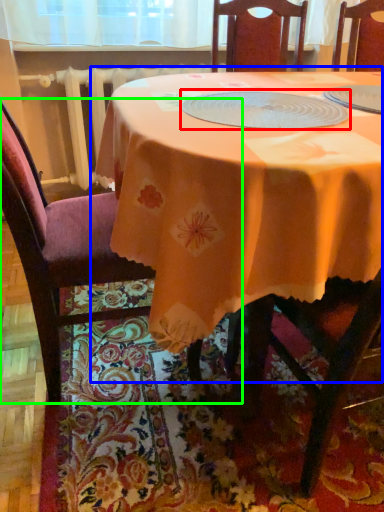
Question: Which object is positioned farthest from tableware (highlighted by a red box)? Select from table (highlighted by a blue box) and chair (highlighted by a green box).

Choices:
 (A) table
 (B) chair

Answer: (B)